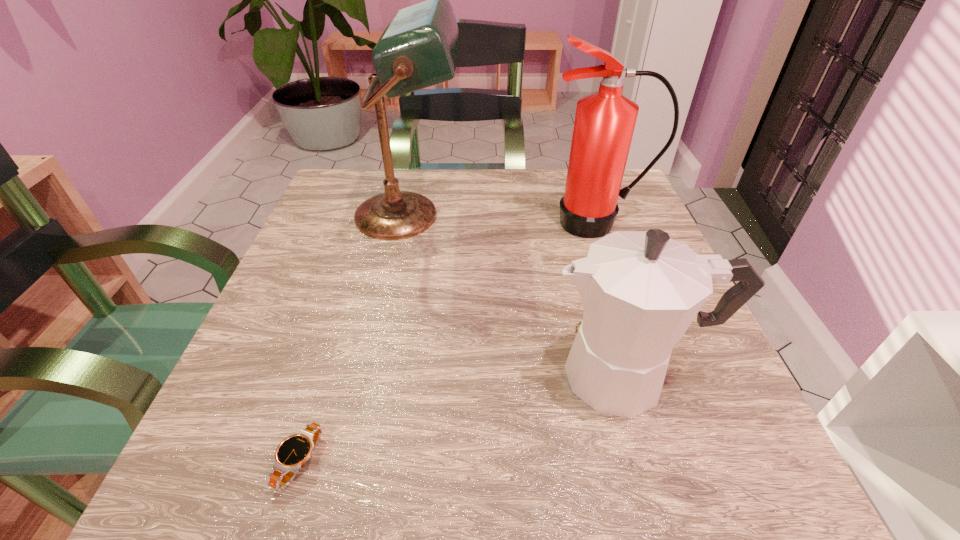
Identify the location of table lamp. The image size is (960, 540). (418, 49).

Find the location of a particular element. The height and width of the screenshot is (540, 960). fire extinguisher is located at coordinates (604, 124).

You are a GUI agent. You are given a task and a screenshot of the screen. Output one action in this format:
    pyautogui.click(x=<x>, y=<y>)
    Task: Click on the third farthest object
    The image size is (960, 540).
    Given the screenshot: What is the action you would take?
    click(641, 290)

I want to click on coffeepot, so click(x=641, y=290).

Find the location of a particular element. watch is located at coordinates (291, 454).

Locate an element on the screen. This screenshot has width=960, height=540. the shortest object is located at coordinates (291, 454).

Locate an element on the screen. vacant space situated 0.250m above the green lampshade of the table lamp is located at coordinates (574, 215).

You are a GUI agent. You are given a task and a screenshot of the screen. Output one action in this format:
    pyautogui.click(x=<x>, y=<y>)
    Task: Click on the vacant space located 0.200m at the spray nozzle of the fire extinguisher
    The height and width of the screenshot is (540, 960).
    Given the screenshot: What is the action you would take?
    pyautogui.click(x=626, y=309)

You are a GUI agent. You are given a task and a screenshot of the screen. Output one action in this format:
    pyautogui.click(x=<x>, y=<y>)
    Task: Click on the blank area located at the spout of the second shortest object
    The width and height of the screenshot is (960, 540).
    Given the screenshot: What is the action you would take?
    pyautogui.click(x=370, y=375)

What are the coordinates of `free location located 0.310m at the spout of the second shortest object` in the screenshot? It's located at (344, 375).